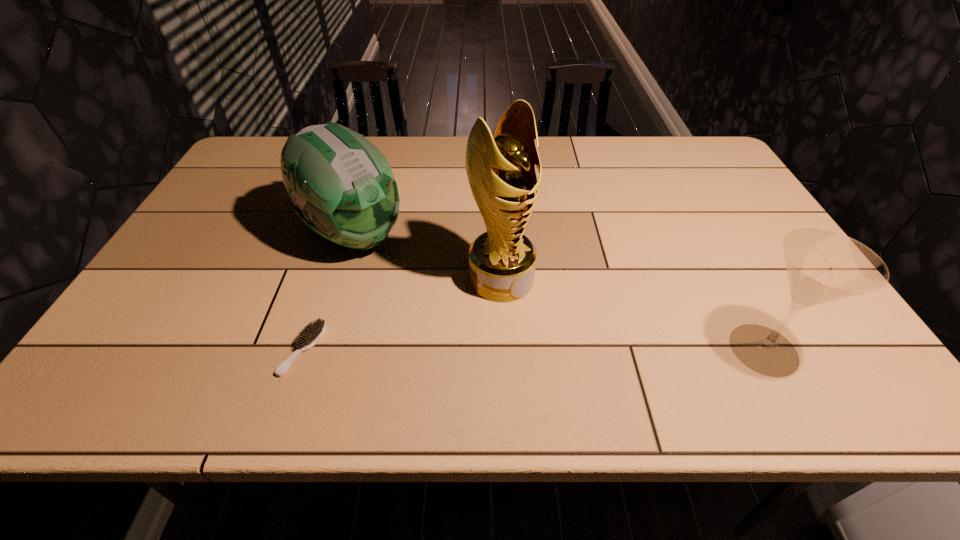
What are the coordinates of `unoccupied area between the scrubbing brush and the football helmet` in the screenshot? It's located at (328, 292).

Locate which object ranks third in proximity to the football helmet. Please provide its 2D coordinates. Your answer should be formatted as a tuple, i.e. [(x, y)], where the tuple contains the x and y coordinates of a point satisfying the conditions above.

[(822, 266)]

Identify which object is located as the nearest to the football helmet. Please provide its 2D coordinates. Your answer should be formatted as a tuple, i.e. [(x, y)], where the tuple contains the x and y coordinates of a point satisfying the conditions above.

[(311, 334)]

Image resolution: width=960 pixels, height=540 pixels. Identify the location of vacant space that satisfies the following two spatial constraints: 1. on the front side of the award; 2. on the right side of the flute glass. (504, 349).

At what (x,y) coordinates should I click in order to perform the action: click on free region that satisfies the following two spatial constraints: 1. on the back side of the football helmet; 2. on the left side of the scrubbing brush. Please return your answer as a coordinate pair (x, y). Image resolution: width=960 pixels, height=540 pixels. Looking at the image, I should click on (342, 234).

This screenshot has width=960, height=540. In order to click on vacant point that satisfies the following two spatial constraints: 1. on the front side of the flute glass; 2. on the right side of the football helmet in this screenshot , I will do `click(318, 349)`.